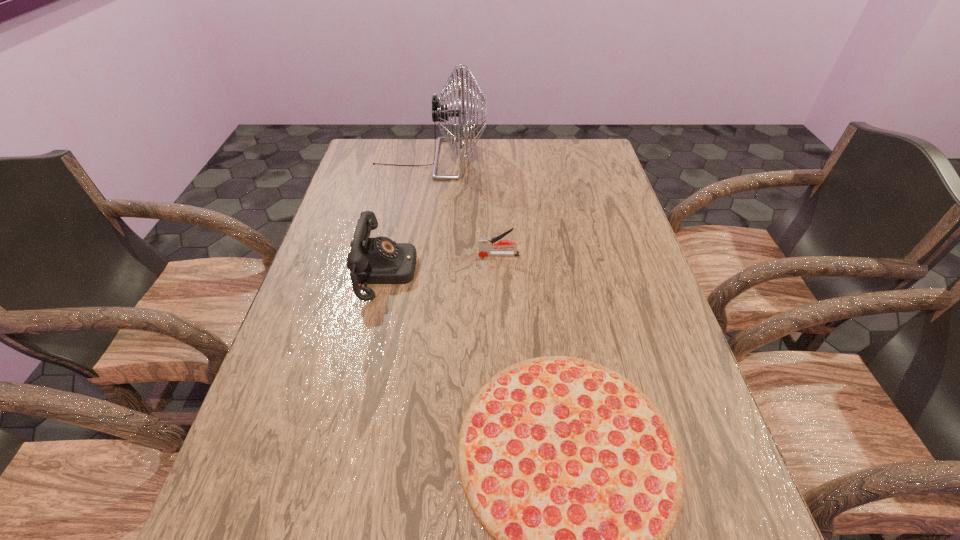
Identify the location of fan located at the left edge. (440, 113).

Find the location of a particular element. The height and width of the screenshot is (540, 960). telephone present at the left edge is located at coordinates (380, 260).

In order to click on object that is positioned at the far left corner in this screenshot , I will do `click(440, 113)`.

The width and height of the screenshot is (960, 540). What are the coordinates of `vacant space at the far edge of the desktop` in the screenshot? It's located at (482, 151).

In the image, there is a desktop. Where is `vacant region at the left edge`? Image resolution: width=960 pixels, height=540 pixels. vacant region at the left edge is located at coordinates (339, 260).

In the image, there is a desktop. Where is `vacant space at the right edge`? vacant space at the right edge is located at coordinates 582,204.

Find the location of a particular element. blank space at the far left corner of the desktop is located at coordinates (392, 151).

In the image, there is a desktop. Identify the location of free space at the far right corner. The width and height of the screenshot is (960, 540). (608, 164).

Find the location of `empty location between the farthest object and the third tallest object`. empty location between the farthest object and the third tallest object is located at coordinates (465, 207).

This screenshot has height=540, width=960. Find the location of `free spot between the stapler and the tallest object`. free spot between the stapler and the tallest object is located at coordinates (465, 207).